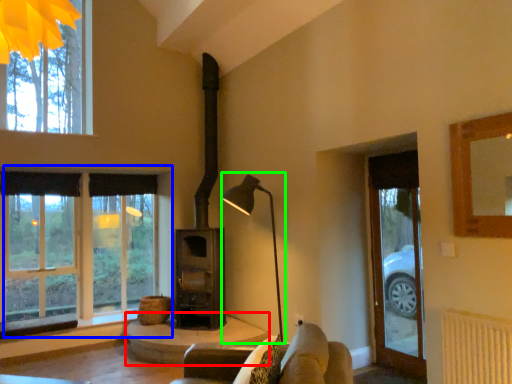
Question: Which object is the closest to the table (highlighted by a red box)? Choose among these: window (highlighted by a blue box) or table lamp (highlighted by a green box).

Choices:
 (A) window
 (B) table lamp

Answer: (B)